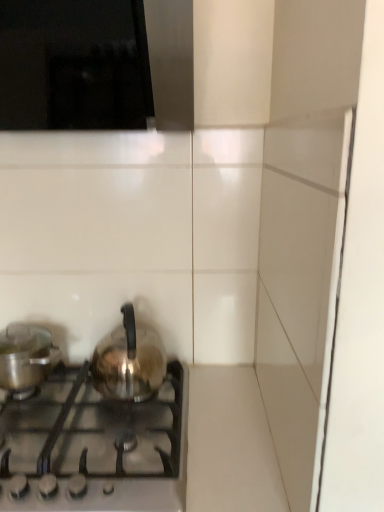
The width and height of the screenshot is (384, 512). Find the location of `free space that is to the left of shiny metallic kettle at center, the 2th kitchen appliance when ordered from left to right`. free space that is to the left of shiny metallic kettle at center, the 2th kitchen appliance when ordered from left to right is located at coordinates (77, 381).